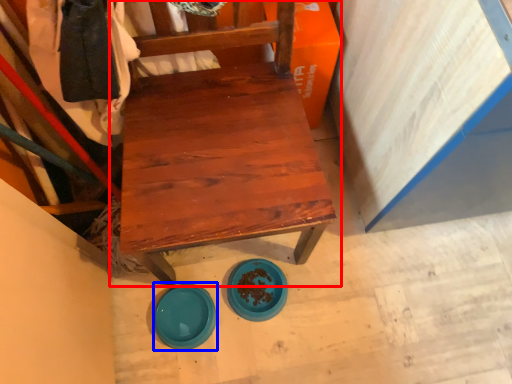
Question: Which object is closer to the camera taking this photo, chair (highlighted by a red box) or plate (highlighted by a blue box)?

Choices:
 (A) chair
 (B) plate

Answer: (A)